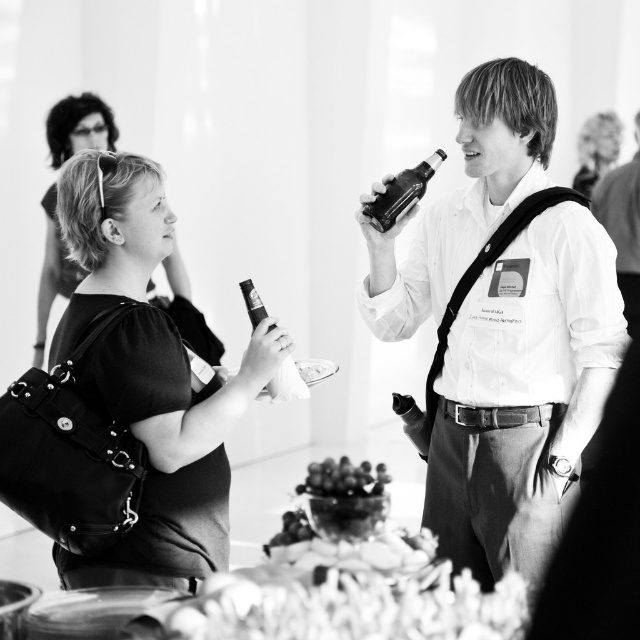
Question: Which of the following is the farthest from the observer?

Choices:
 (A) (268, 330)
 (B) (168, 346)
 (C) (461, 253)

Answer: (C)

Question: Which of the following is the closest to the observer?

Choices:
 (A) shiny glass bottle at upper right
 (B) smooth skin face at upper right
 (C) matte black dress at center

Answer: (A)

Question: Can you confirm if smooth glass bottle at center is smaller than matte black dress at center?

Choices:
 (A) no
 (B) yes

Answer: (A)

Question: Can you confirm if matte black dress at center is positioned below smooth glass grapes at center?

Choices:
 (A) no
 (B) yes

Answer: (A)

Question: Based on their relative distances, which object is nearer to the smooth skin face at upper right?

Choices:
 (A) matte glass bottle at center
 (B) matte black dress at center

Answer: (B)

Question: In this image, where is matte black dress at center located relative to shiny glass bottle at upper right?

Choices:
 (A) above
 (B) below

Answer: (A)